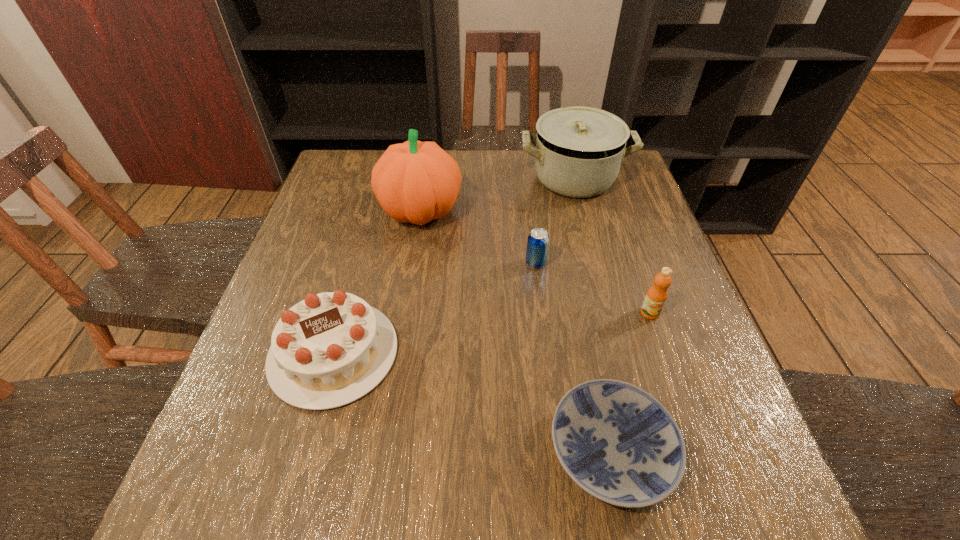
Locate an element on the screen. This screenshot has height=540, width=960. object located at the far right corner is located at coordinates (578, 151).

Locate an element on the screen. object that is at the near right corner is located at coordinates (618, 443).

Image resolution: width=960 pixels, height=540 pixels. What are the coordinates of `vacant point at the far edge` in the screenshot? It's located at (461, 152).

I want to click on free space at the near edge of the desktop, so [x=293, y=523].

In the image, there is a desktop. Identify the location of free space at the left edge. The image size is (960, 540). (251, 383).

Where is `vacant position at the right edge of the desktop`? This screenshot has width=960, height=540. vacant position at the right edge of the desktop is located at coordinates (703, 406).

In the image, there is a desktop. Where is `vacant space at the near right corner`? Image resolution: width=960 pixels, height=540 pixels. vacant space at the near right corner is located at coordinates (667, 499).

Locate an element on the screen. free spot between the plate and the birthday cake is located at coordinates (472, 402).

Locate an element on the screen. The width and height of the screenshot is (960, 540). vacant area that lies between the orange juice and the birthday cake is located at coordinates (492, 333).

Locate an element on the screen. The height and width of the screenshot is (540, 960). empty location between the third shortest object and the saucepan is located at coordinates (454, 266).